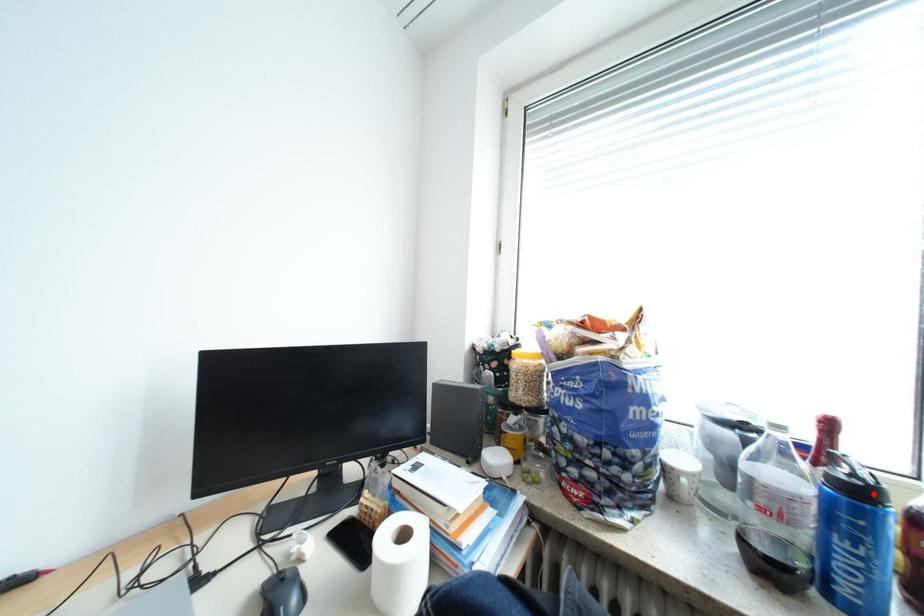
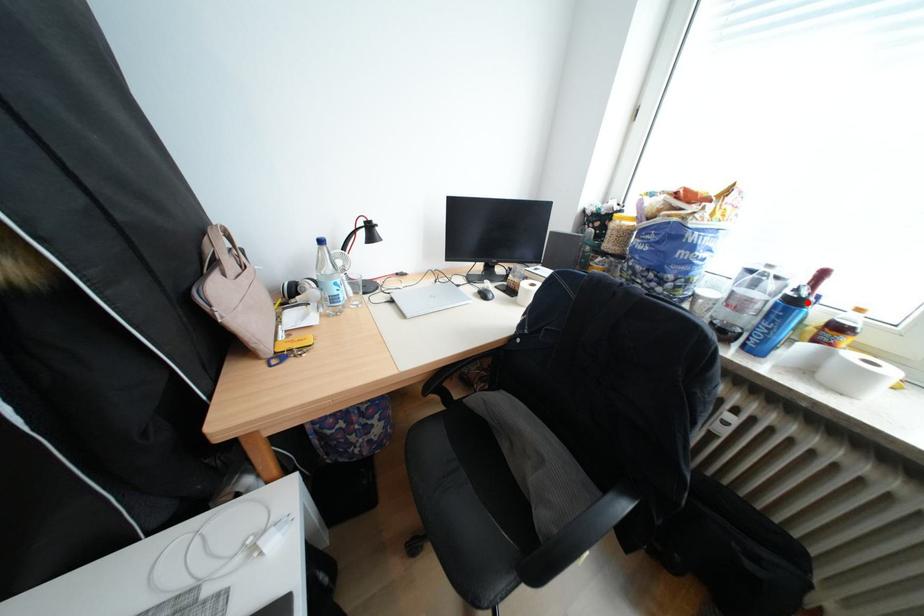
I am providing you with two images of the same scene from different viewpoints. A red point is marked on the first image and another point is marked on the second image. Is the red point in image1 aligned with the point shown in image2?

Yes